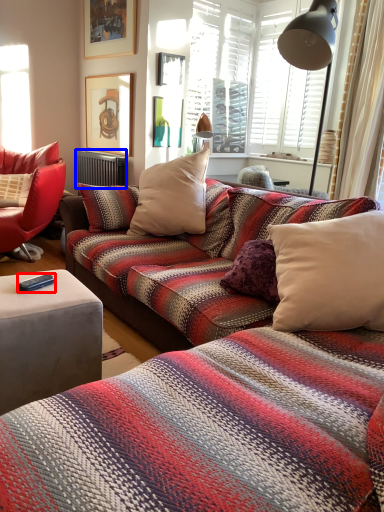
Question: Which of the following is the closest to the observer, remote control (highlighted by a red box) or radiator (highlighted by a blue box)?

Choices:
 (A) remote control
 (B) radiator

Answer: (A)